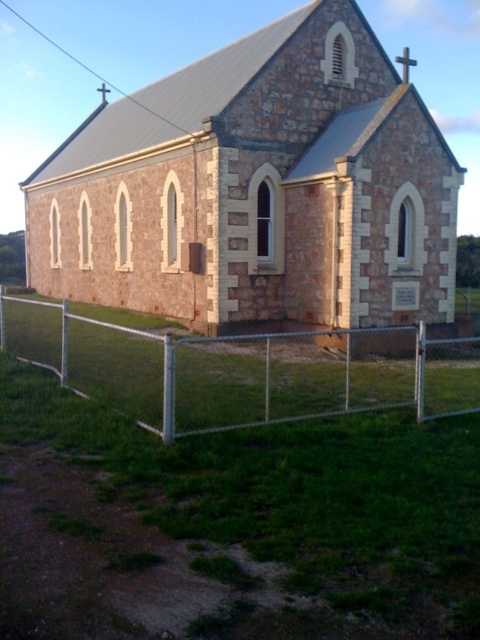
Question: Can you confirm if stone church at center is thinner than metal chain-link fence at lower center?

Choices:
 (A) no
 (B) yes

Answer: (A)

Question: Can you confirm if stone church at center is smaller than metal chain-link fence at lower center?

Choices:
 (A) yes
 (B) no

Answer: (B)

Question: Is stone church at center bigger than metal chain-link fence at lower center?

Choices:
 (A) yes
 (B) no

Answer: (A)

Question: Which point is closer to the camera?

Choices:
 (A) (229, 324)
 (B) (301, 378)

Answer: (B)

Question: Which of the following is the closest to the observer?

Choices:
 (A) stone church at center
 (B) metal chain-link fence at lower center

Answer: (B)